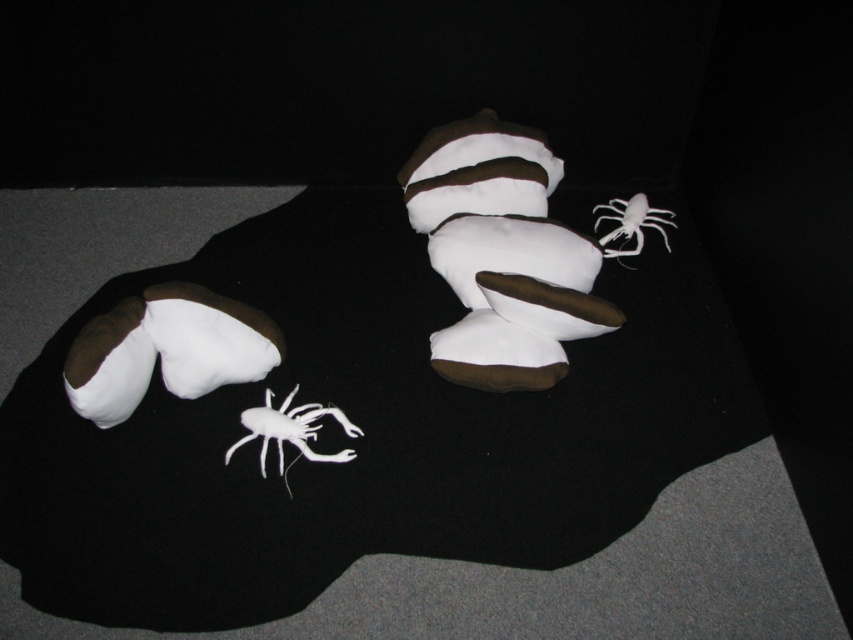
You are standing in front of the image and see two points labeled as point [320,452] and point [608,237]. Which point is nearer to you?

Point [320,452] is closer to the viewer than point [608,237].

You are standing in a room with two white and brown slipper feet on a dark surface. There is a point marked at coordinates [291,432]. Which object is located at that point?

The point at coordinates [291,432] corresponds to the white matte spider at lower center.